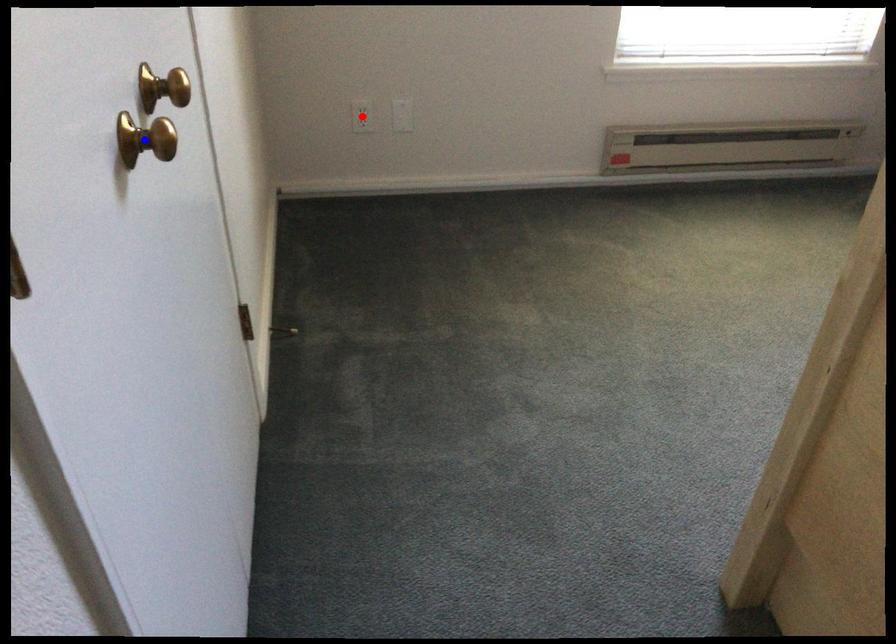
Question: Which of the two points in the image is closer to the camera?

Choices:
 (A) Blue point is closer.
 (B) Red point is closer.

Answer: (A)